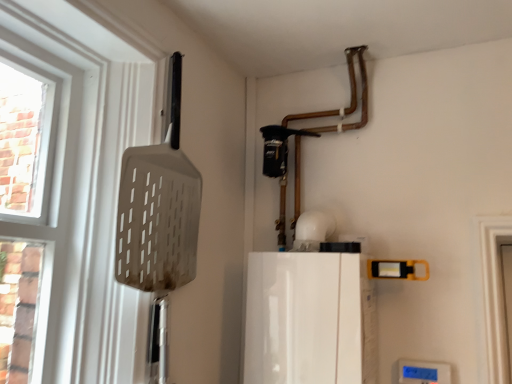
At what (x,y) coordinates should I click in order to perform the action: click on metallic silver shovel at left. Please return your answer as a coordinate pair (x, y). Looking at the image, I should click on (x=159, y=208).

The image size is (512, 384). Describe the element at coordinates (159, 208) in the screenshot. I see `metallic silver shovel at left` at that location.

Image resolution: width=512 pixels, height=384 pixels. Find the location of `metallic silver shovel at left`. metallic silver shovel at left is located at coordinates (159, 208).